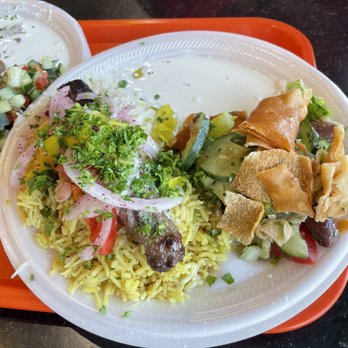
Where is `smallest paper plate`? The width and height of the screenshot is (348, 348). smallest paper plate is located at coordinates [43, 40].